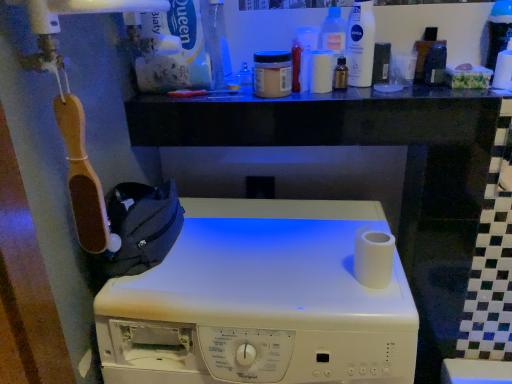
The width and height of the screenshot is (512, 384). I want to click on vacant space in front of white matte toilet paper at right, which is the first toilet paper in front-to-back order, so click(372, 302).